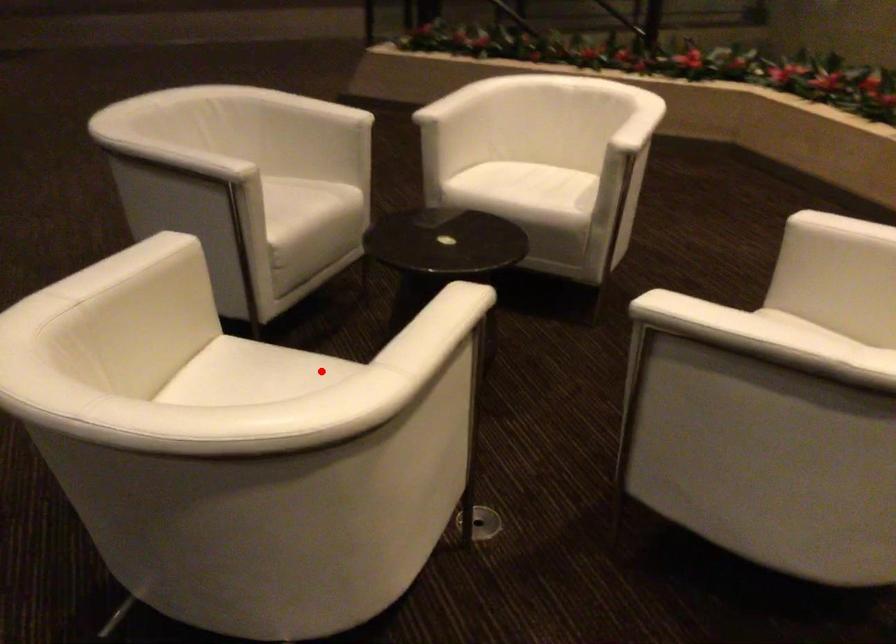
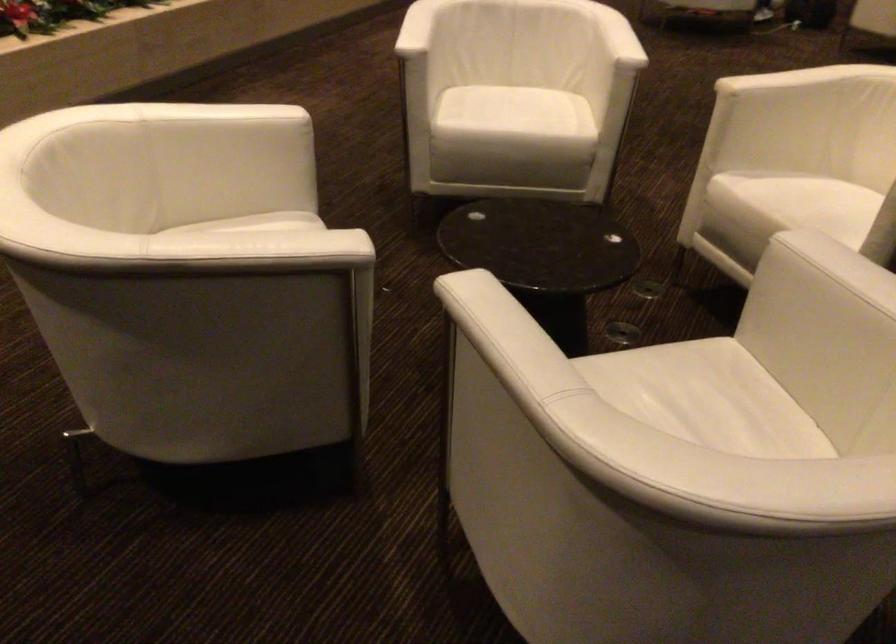
Where in the second image is the point corresponding to the highlighted location from the first image?

(794, 198)